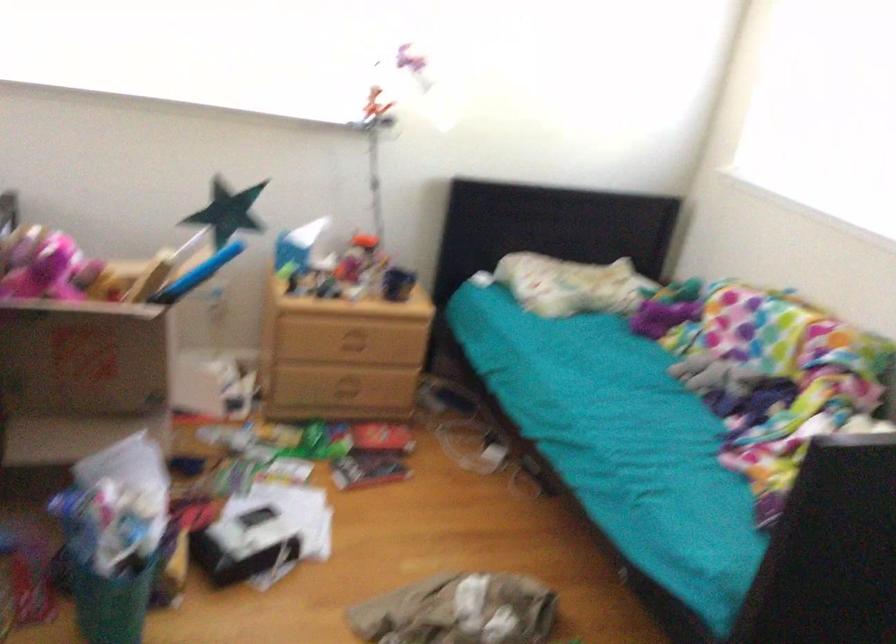
Find where to pull the drawer handle. Please return your answer as a coordinate pair (x, y).

(352, 343)